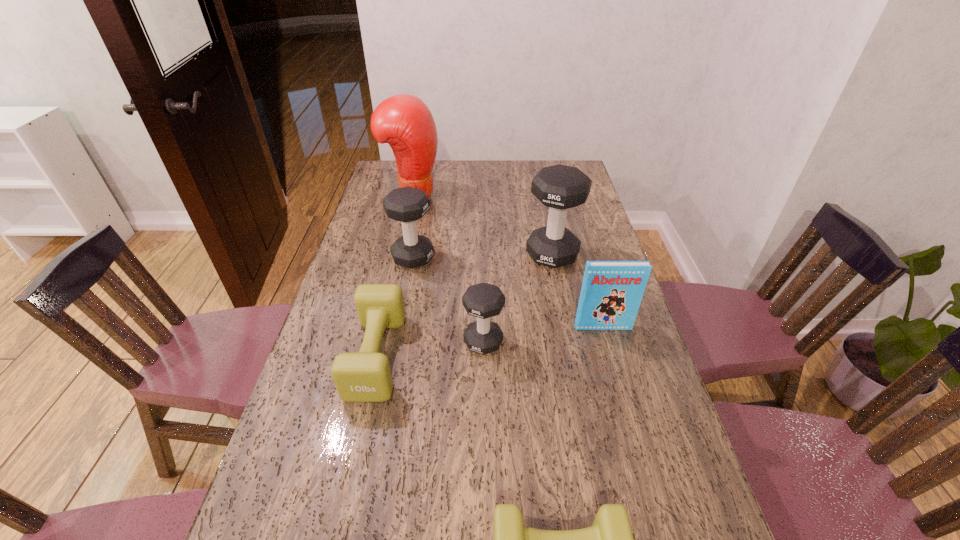
This screenshot has width=960, height=540. Find the location of `book that is at the right edge`. book that is at the right edge is located at coordinates (612, 291).

You are a GUI agent. You are given a task and a screenshot of the screen. Output one action in this format:
    pyautogui.click(x=<x>, y=<y>)
    Task: Click on the object positioned at the far left corner
    This screenshot has height=540, width=960.
    Given the screenshot: What is the action you would take?
    pyautogui.click(x=404, y=121)

The width and height of the screenshot is (960, 540). I want to click on vacant space at the far edge, so click(535, 169).

The width and height of the screenshot is (960, 540). I want to click on vacant point at the left edge, so click(x=359, y=335).

The height and width of the screenshot is (540, 960). In the image, there is a desktop. What are the coordinates of `vacant space at the right edge` in the screenshot? It's located at (594, 211).

In the image, there is a desktop. In order to click on vacant area at the far left corner in this screenshot , I will do `click(388, 184)`.

The image size is (960, 540). In order to click on vacant region between the third shortest dumbbell and the sixth shortest object in this screenshot , I will do `click(517, 298)`.

Where is `vacant area that lies between the tallest dumbbell and the red boxing glove`? vacant area that lies between the tallest dumbbell and the red boxing glove is located at coordinates (482, 226).

Identify the location of vacant area that lies between the third shortest dumbbell and the book. (543, 335).

What are the coordinates of `vacant point located between the third shortest dumbbell and the blue book` in the screenshot? It's located at pos(543,335).